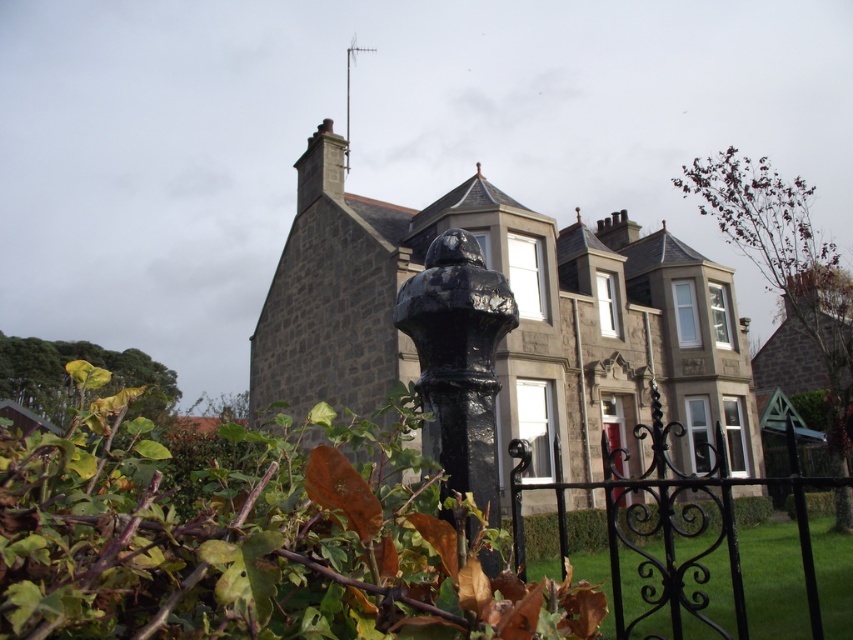
Question: Observing the image, what is the correct spatial positioning of black wrought iron gate at lower right in reference to glossy black post at center?

Choices:
 (A) left
 (B) right

Answer: (B)

Question: Among these points, which one is nearest to the camera?

Choices:
 (A) (706, 476)
 (B) (468, 365)

Answer: (B)

Question: Does black wrought iron gate at lower right have a smaller size compared to glossy black post at center?

Choices:
 (A) yes
 (B) no

Answer: (B)

Question: Observing the image, what is the correct spatial positioning of black wrought iron gate at lower right in reference to glossy black post at center?

Choices:
 (A) right
 (B) left

Answer: (A)

Question: Which object is farther from the camera taking this photo?

Choices:
 (A) glossy black post at center
 (B) black wrought iron gate at lower right

Answer: (B)